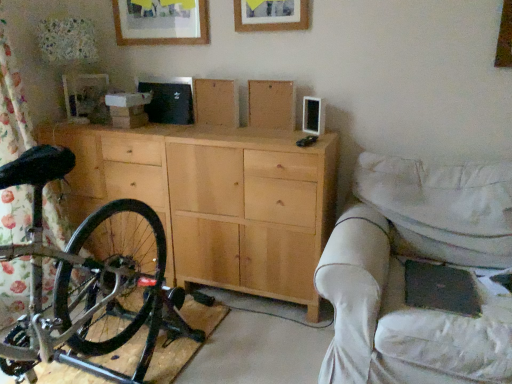
Question: Is wooden picture frame at upper center, which is counted as the second picture frame, starting from the front, oriented away from wooden picture frame at upper center, which is counted as the 1th picture frame, starting from the right?

Choices:
 (A) no
 (B) yes

Answer: (A)

Question: Can you confirm if wooden picture frame at upper center, acting as the first picture frame starting from the back, is taller than wooden picture frame at upper center, which is counted as the 1th picture frame, starting from the right?

Choices:
 (A) no
 (B) yes

Answer: (A)

Question: Considering the relative positions of wooden picture frame at upper center, acting as the first picture frame starting from the back, and wooden picture frame at upper center, which is counted as the 1th picture frame, starting from the right, in the image provided, is wooden picture frame at upper center, acting as the first picture frame starting from the back, to the left of wooden picture frame at upper center, which is counted as the 1th picture frame, starting from the right, from the viewer's perspective?

Choices:
 (A) yes
 (B) no

Answer: (A)

Question: Does wooden picture frame at upper center, acting as the first picture frame starting from the back, have a lesser width compared to wooden picture frame at upper center, marked as the second picture frame in a left-to-right arrangement?

Choices:
 (A) no
 (B) yes

Answer: (A)

Question: Is wooden picture frame at upper center, the 2th picture frame in the right-to-left sequence, positioned before wooden picture frame at upper center, marked as the second picture frame in a left-to-right arrangement?

Choices:
 (A) yes
 (B) no

Answer: (B)

Question: Can you confirm if wooden picture frame at upper center, acting as the first picture frame starting from the back, is positioned to the right of wooden picture frame at upper center, marked as the second picture frame in a left-to-right arrangement?

Choices:
 (A) yes
 (B) no

Answer: (B)

Question: Is wooden picture frame at upper center, acting as the first picture frame starting from the back, aimed at natural wood cabinet at center?

Choices:
 (A) no
 (B) yes

Answer: (A)

Question: Considering the relative sizes of wooden picture frame at upper center, which is the 1th picture frame in left-to-right order, and natural wood cabinet at center in the image provided, is wooden picture frame at upper center, which is the 1th picture frame in left-to-right order, bigger than natural wood cabinet at center?

Choices:
 (A) yes
 (B) no

Answer: (B)

Question: Is wooden picture frame at upper center, which is the 1th picture frame in left-to-right order, positioned behind natural wood cabinet at center?

Choices:
 (A) no
 (B) yes

Answer: (B)

Question: Is wooden picture frame at upper center, the 2th picture frame in the right-to-left sequence, shorter than natural wood cabinet at center?

Choices:
 (A) no
 (B) yes

Answer: (B)

Question: Does wooden picture frame at upper center, which is the 1th picture frame in left-to-right order, lie in front of natural wood cabinet at center?

Choices:
 (A) yes
 (B) no

Answer: (B)

Question: Can you confirm if wooden picture frame at upper center, which is the 1th picture frame in left-to-right order, is taller than natural wood cabinet at center?

Choices:
 (A) no
 (B) yes

Answer: (A)

Question: Is shiny black bicycle at left not within white fabric couch at right?

Choices:
 (A) no
 (B) yes

Answer: (B)